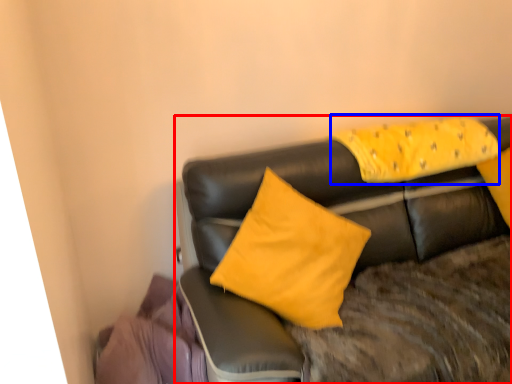
Question: Which object appears closest to the camera in this image, studio couch (highlighted by a red box) or pillow (highlighted by a blue box)?

Choices:
 (A) studio couch
 (B) pillow

Answer: (A)